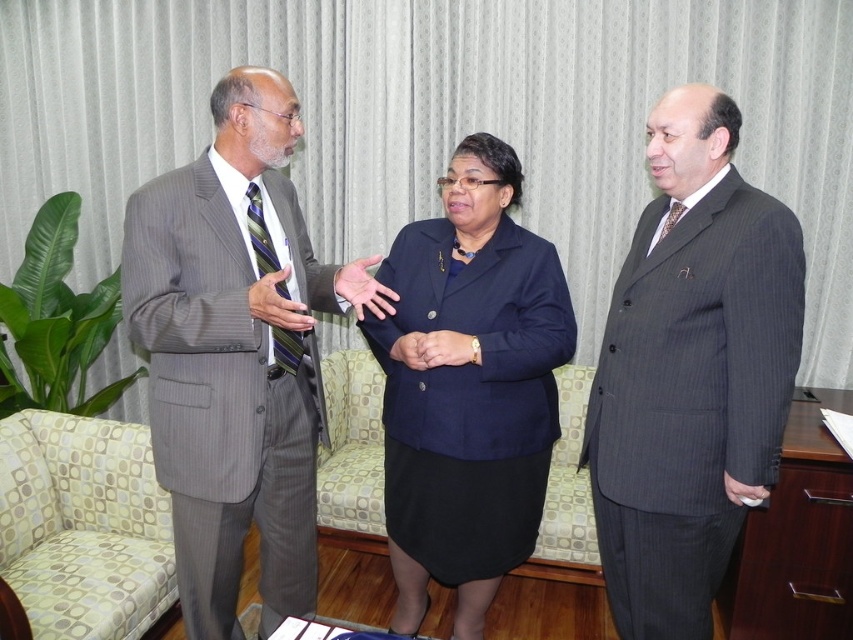
Can you confirm if gray pinstripe suit at left is positioned below gray pinstripe suit at right?

Correct, gray pinstripe suit at left is located below gray pinstripe suit at right.

Is point (302, 300) farther from viewer compared to point (694, 440)?

That is True.

Between point (184, 284) and point (659, 628), which one is positioned in front?

Positioned in front is point (184, 284).

Locate an element on the screen. This screenshot has width=853, height=640. gray pinstripe suit at left is located at coordinates (236, 353).

Is navy blue fabric skirt at center taller than yellow-green patterned armchair at center?

Correct, navy blue fabric skirt at center is much taller as yellow-green patterned armchair at center.

Who is shorter, navy blue fabric skirt at center or yellow-green patterned armchair at center?

With less height is yellow-green patterned armchair at center.

You are a GUI agent. You are given a task and a screenshot of the screen. Output one action in this format:
    pyautogui.click(x=<x>, y=<y>)
    Task: Click on the navy blue fabric skirt at center
    The height and width of the screenshot is (640, 853).
    Given the screenshot: What is the action you would take?
    pyautogui.click(x=468, y=387)

What are the coordinates of `navy blue fabric skirt at center` in the screenshot? It's located at (468, 387).

Can you confirm if gray pinstripe suit at left is wider than navy blue fabric skirt at center?

Yes.

Does point (189, 490) lie behind point (486, 176)?

No, (189, 490) is in front of (486, 176).

At what (x,y) coordinates should I click in order to perform the action: click on gray pinstripe suit at left. Please return your answer as a coordinate pair (x, y). Image resolution: width=853 pixels, height=640 pixels. Looking at the image, I should click on (236, 353).